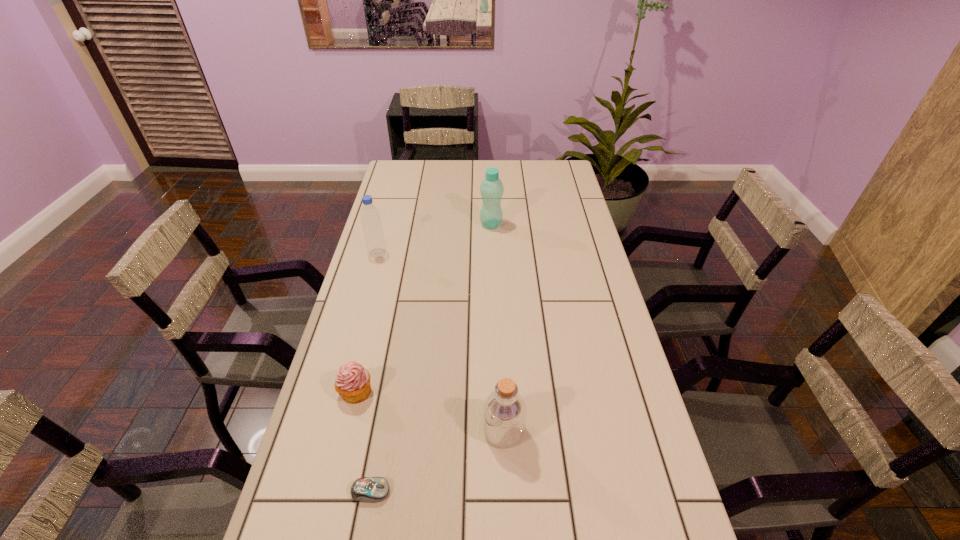
Find the location of a particular element. free space that is in between the shortest object and the third nearest object is located at coordinates (363, 441).

At what (x,y) coordinates should I click in order to perform the action: click on unoccupied position between the shortest object and the third farthest object. Please return your answer as a coordinate pair (x, y). This screenshot has height=540, width=960. Looking at the image, I should click on (363, 441).

Locate an element on the screen. This screenshot has width=960, height=540. vacant area that lies between the third tallest object and the second farthest object is located at coordinates (441, 342).

Identify the location of free area in between the fourth nearest object and the third shortest object. This screenshot has width=960, height=540. (441, 342).

Locate an element on the screen. free area in between the nearest object and the farthest object is located at coordinates (431, 358).

This screenshot has height=540, width=960. Identify the location of vacant area that lies between the second farthest object and the farthest bottle. (434, 239).

You are a GUI agent. You are given a task and a screenshot of the screen. Output one action in this format:
    pyautogui.click(x=<x>, y=<y>)
    Task: Click on the empty location between the shortest object and the leftmost bottle
    
    Given the screenshot: What is the action you would take?
    pyautogui.click(x=374, y=373)

Locate an element on the screen. This screenshot has height=540, width=960. vacant point located between the third farthest object and the farthest bottle is located at coordinates (423, 308).

Find the location of a particular element. This screenshot has height=540, width=960. vacant space that's between the second farthest bottle and the farthest object is located at coordinates (434, 239).

Identify the location of object that is the third closest to the nearest object. (370, 217).